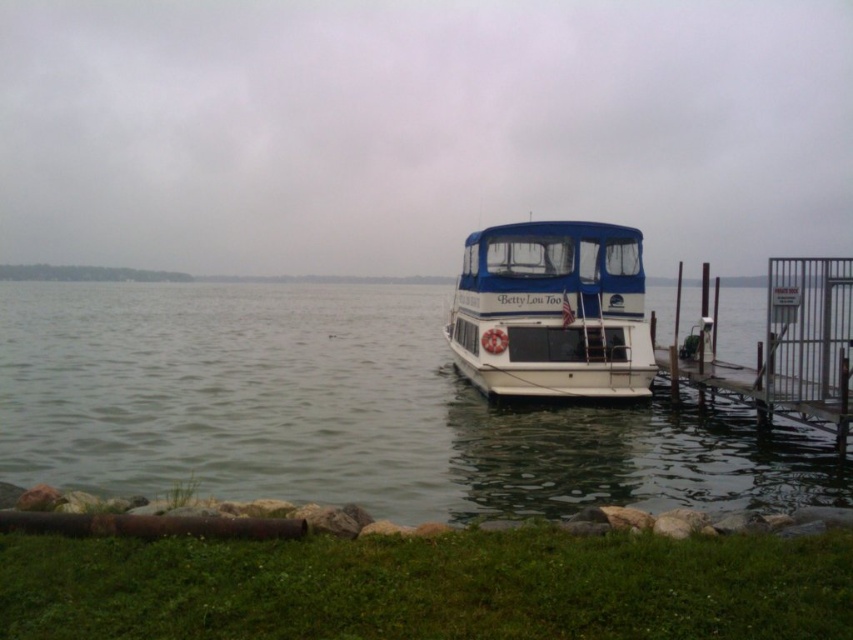
Question: Which of the following is the farthest from the observer?

Choices:
 (A) clear water at center
 (B) white glossy houseboat at center

Answer: (B)

Question: Does clear water at center have a smaller size compared to white glossy houseboat at center?

Choices:
 (A) yes
 (B) no

Answer: (B)

Question: Is white glossy houseboat at center smaller than metallic gray dock at lower right?

Choices:
 (A) yes
 (B) no

Answer: (A)

Question: Among these points, which one is nearest to the camera?

Choices:
 (A) (805, 356)
 (B) (489, 385)

Answer: (A)

Question: Considering the real-world distances, which object is farthest from the metallic gray dock at lower right?

Choices:
 (A) clear water at center
 (B) white glossy houseboat at center

Answer: (A)

Question: Does white glossy houseboat at center have a lesser width compared to metallic gray dock at lower right?

Choices:
 (A) yes
 (B) no

Answer: (A)